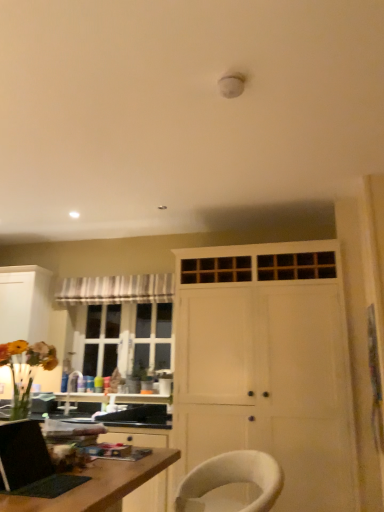
Where is `free spot to the right of matte black laptop at lower left`? This screenshot has height=512, width=384. free spot to the right of matte black laptop at lower left is located at coordinates (100, 488).